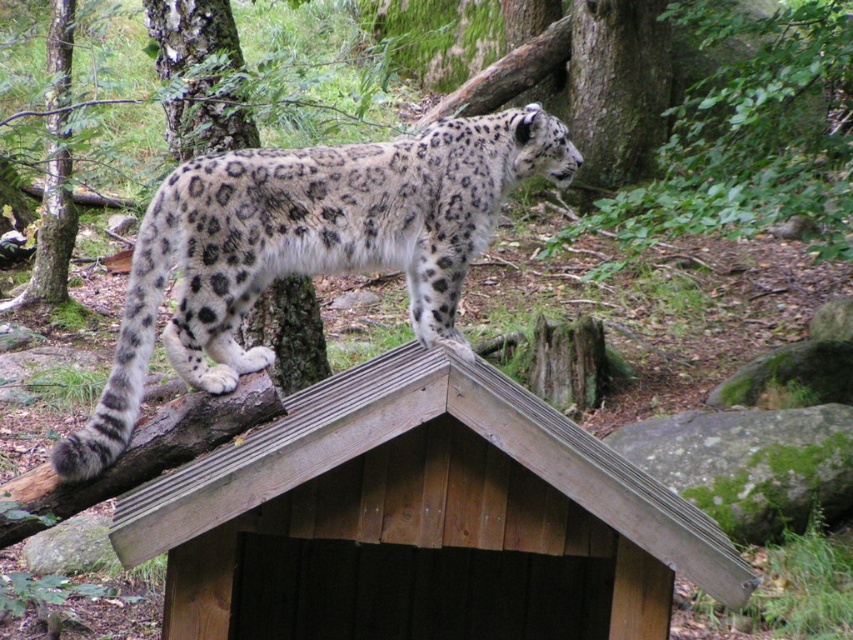
You are a wildlife photographer aiming to capture a clear photo of the spotted fur leopard at center. However, the brown wooden hut at upper center is blocking your view. Can you move to the left to get a better shot without the hut obstructing the leopard?

The brown wooden hut at upper center is positioned under the spotted fur leopard at center, so moving to the left might not help as the hut is below the leopard. To avoid obstruction, you should move to the right side instead.

You are a hiker in the forest and see the snow leopard on the roof of a structure. There is a point marked at coordinates (421,520). What object is located at that point?

The brown wooden hut at upper center is located at point (421,520).

You are a wildlife photographer aiming to capture the snow leopard on the wooden structure. You notice two points marked in the image. Which point, point [726,600] or point [463,348], is closer to your camera lens?

Point [726,600] is closer to the camera lens than point [463,348].